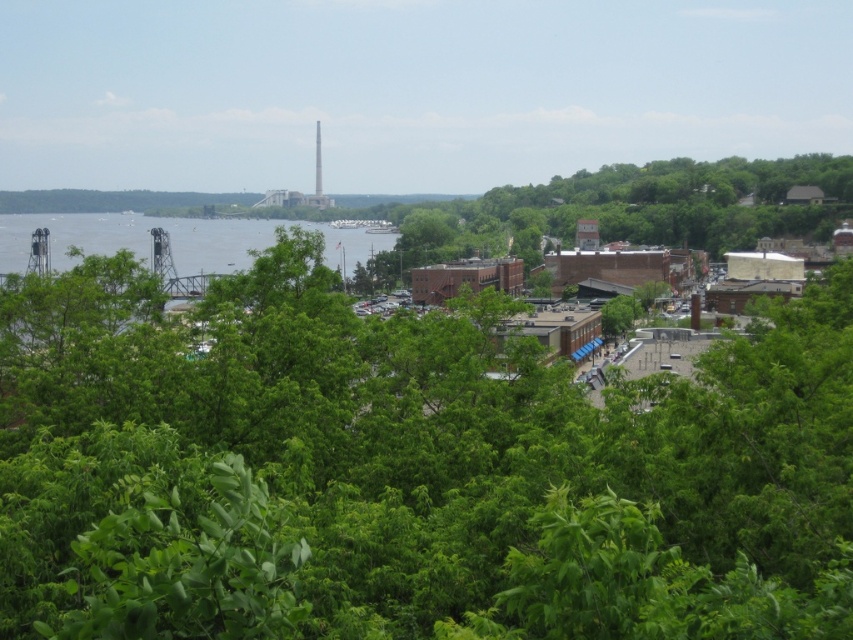
Is point (57, 605) more distant than point (532, 243)?

That is False.

Does green leafy tree at center appear on the left side of green leafy tree at upper right?

Correct, you'll find green leafy tree at center to the left of green leafy tree at upper right.

Between point (15, 392) and point (705, 164), which one is positioned behind?

The point (705, 164) is more distant.

The image size is (853, 640). I want to click on green leafy tree at center, so click(x=405, y=468).

Which is in front, point (345, 346) or point (317, 172)?

Point (345, 346) is more forward.

Looking at this image, between green leafy tree at center and white concrete tower at upper center, which one appears on the right side from the viewer's perspective?

green leafy tree at center is more to the right.

Identify the location of green leafy tree at center. (405, 468).

Which is more to the right, green water at left or white concrete tower at upper center?

white concrete tower at upper center

Between green water at left and white concrete tower at upper center, which one is positioned lower?

green water at left is below.

Which is behind, point (19, 266) or point (318, 124)?

The point (318, 124) is behind.

Locate an element on the screen. The image size is (853, 640). green water at left is located at coordinates (177, 241).